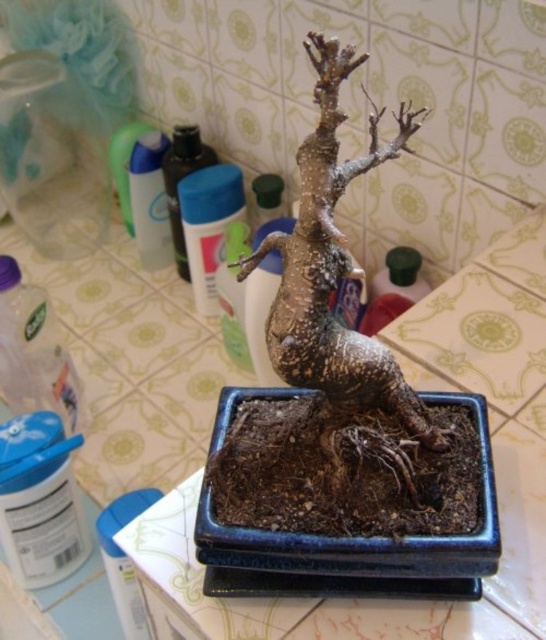
Does point (382, 275) lie in front of point (182, 145)?

Yes, point (382, 275) is in front of point (182, 145).

Does green plastic bottle at center-right have a greater width compared to translucent plastic bottle at upper left?

Indeed, green plastic bottle at center-right has a greater width compared to translucent plastic bottle at upper left.

Is point (394, 253) closer to camera compared to point (170, 148)?

Yes, point (394, 253) is closer to viewer.

Locate an element on the screen. Image resolution: width=546 pixels, height=640 pixels. green plastic bottle at center-right is located at coordinates (394, 289).

Can you confirm if clear plastic bottle at lower left is bigger than green plastic bottle at center-right?

Correct, clear plastic bottle at lower left is larger in size than green plastic bottle at center-right.

Can you confirm if clear plastic bottle at lower left is positioned above green plastic bottle at center-right?

Incorrect, clear plastic bottle at lower left is not positioned above green plastic bottle at center-right.

Describe the element at coordinates (33, 352) in the screenshot. I see `clear plastic bottle at lower left` at that location.

What are the coordinates of `clear plastic bottle at lower left` in the screenshot? It's located at (33, 352).

Does clear plastic bottle at lower left have a lesser height compared to translucent plastic bottle at upper left?

Indeed, clear plastic bottle at lower left has a lesser height compared to translucent plastic bottle at upper left.

Is clear plastic bottle at lower left taller than translucent plastic bottle at upper left?

No.

Which is behind, point (2, 323) or point (173, 168)?

Point (173, 168)

Where is `clear plastic bottle at lower left`? This screenshot has height=640, width=546. clear plastic bottle at lower left is located at coordinates (33, 352).